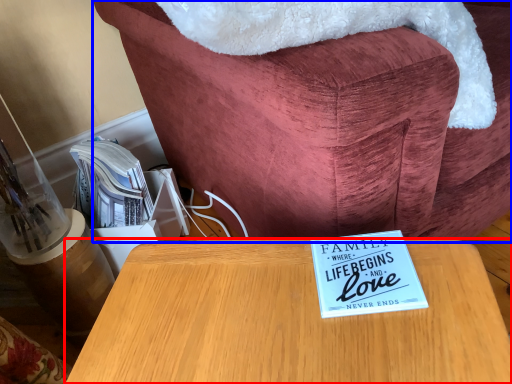
Question: Which object appears farthest to the camera in this image, table (highlighted by a red box) or furniture (highlighted by a blue box)?

Choices:
 (A) table
 (B) furniture

Answer: (B)